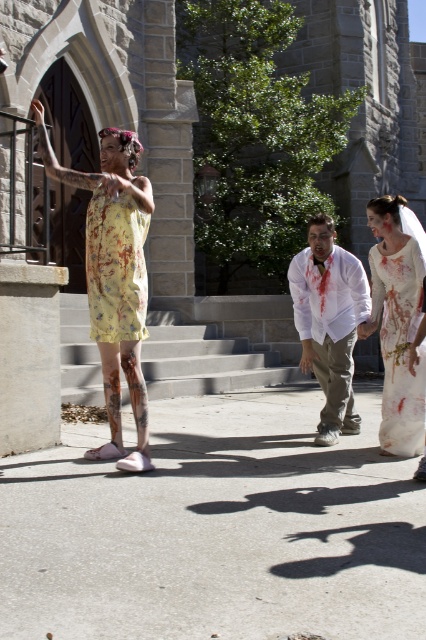
You are organizing a costume parade where participants must walk single file through a narrow corridor. Given the image of the yellow printed dress at left and the white satin dress at center, which costume should be adjusted to ensure they can pass through the corridor without touching each other?

The yellow printed dress at left has a greater width than the white satin dress at center. To ensure they can pass through the corridor without touching, the yellow printed dress at left should be adjusted to reduce its width so both can move through the narrow space.